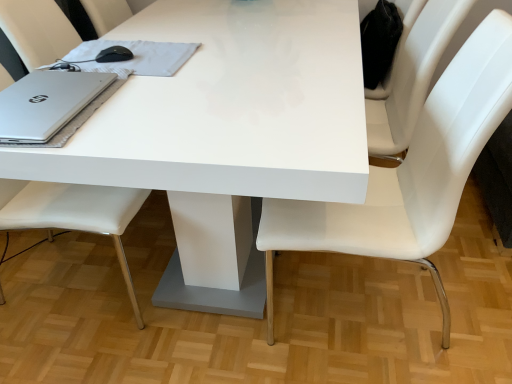
Identify the location of space that is in front of white leather chair at left, which appears as the first chair when viewed from the left. pos(82,350).